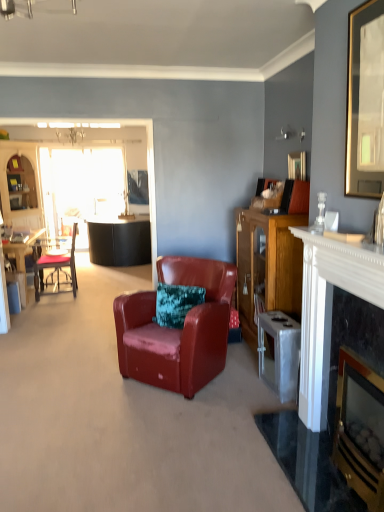
This screenshot has width=384, height=512. I want to click on blank space to the left of metallic silver trash can at right, so click(243, 388).